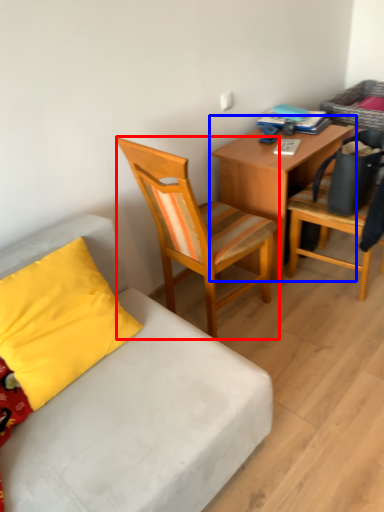
Question: Which object appears farthest to the camera in this image, chair (highlighted by a red box) or desk (highlighted by a blue box)?

Choices:
 (A) chair
 (B) desk

Answer: (B)